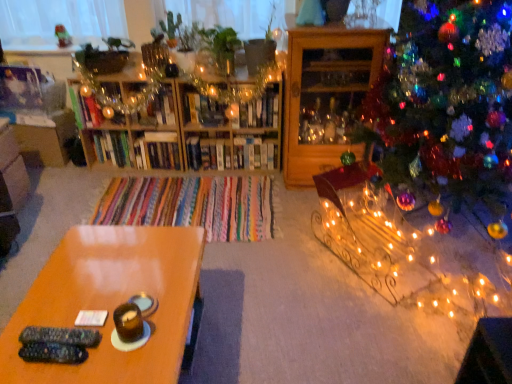
Question: From a real-world perspective, is glossy wood table at lower left on white glossy bookshelf at center, acting as the 2th shelf starting from the left?

Choices:
 (A) no
 (B) yes

Answer: (B)

Question: Is glossy wood table at lower left aimed at white glossy bookshelf at center, the second shelf when ordered from right to left?

Choices:
 (A) yes
 (B) no

Answer: (B)

Question: From a real-world perspective, is glossy wood table at lower left physically below white glossy bookshelf at center, the second shelf when ordered from right to left?

Choices:
 (A) no
 (B) yes

Answer: (A)

Question: Is glossy wood table at lower left thinner than white glossy bookshelf at center, the second shelf when ordered from right to left?

Choices:
 (A) yes
 (B) no

Answer: (B)

Question: Does glossy wood table at lower left have a smaller size compared to white glossy bookshelf at center, acting as the 2th shelf starting from the left?

Choices:
 (A) yes
 (B) no

Answer: (B)

Question: Would you say glossy wood table at lower left is outside white glossy bookshelf at center, acting as the 2th shelf starting from the left?

Choices:
 (A) no
 (B) yes

Answer: (B)

Question: Does wooden cabinet at right, arranged as the first shelf when viewed from the right, have a greater width compared to iridescent glass ornaments at right?

Choices:
 (A) yes
 (B) no

Answer: (B)

Question: Can you confirm if wooden cabinet at right, the 3th shelf in the left-to-right sequence, is thinner than iridescent glass ornaments at right?

Choices:
 (A) yes
 (B) no

Answer: (A)

Question: Does wooden cabinet at right, arranged as the first shelf when viewed from the right, turn towards iridescent glass ornaments at right?

Choices:
 (A) yes
 (B) no

Answer: (B)

Question: Can you confirm if wooden cabinet at right, the 3th shelf in the left-to-right sequence, is smaller than iridescent glass ornaments at right?

Choices:
 (A) yes
 (B) no

Answer: (A)

Question: Can you confirm if wooden cabinet at right, the 3th shelf in the left-to-right sequence, is taller than iridescent glass ornaments at right?

Choices:
 (A) yes
 (B) no

Answer: (B)

Question: Is iridescent glass ornaments at right at the back of wooden cabinet at right, the 3th shelf in the left-to-right sequence?

Choices:
 (A) yes
 (B) no

Answer: (B)

Question: From the image's perspective, is white glossy bookshelf at center, the second shelf when ordered from right to left, above iridescent glass ornaments at right?

Choices:
 (A) yes
 (B) no

Answer: (B)